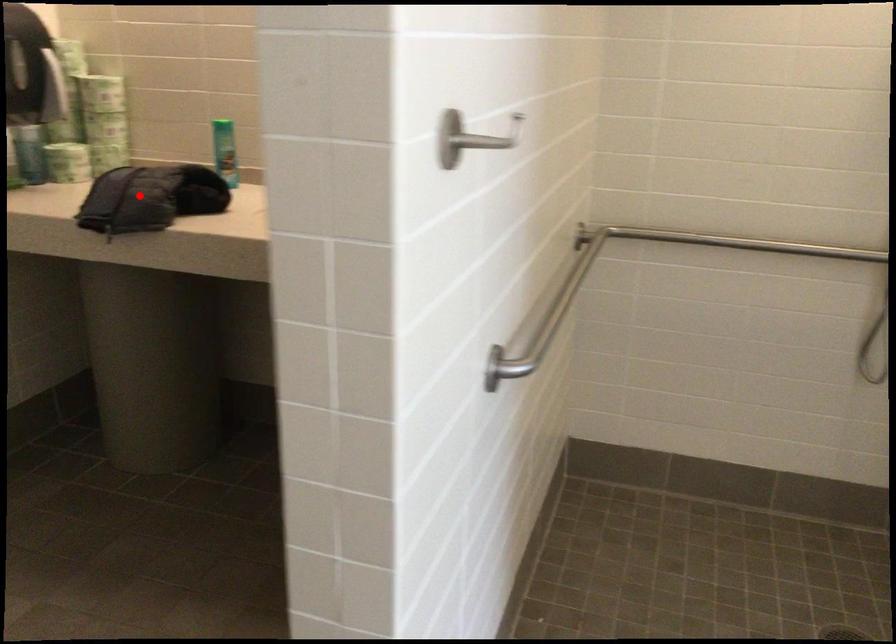
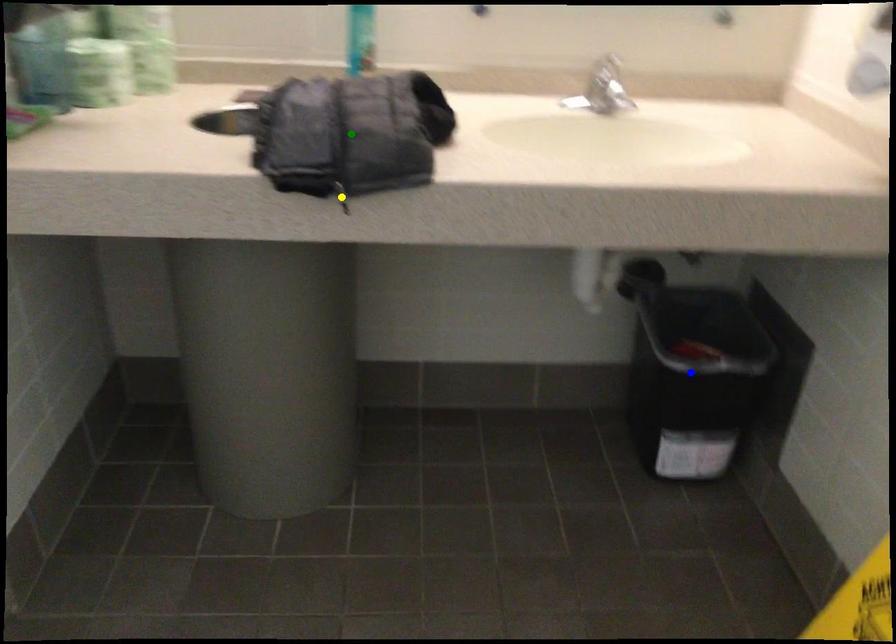
Question: I am providing you with two images of the same scene from different viewpoints. A red point is marked on the first image. You are given multiple points on the second image. In image 2, which mark is for the same physical point as the one in image 1?

Choices:
 (A) yellow point
 (B) blue point
 (C) green point

Answer: (C)